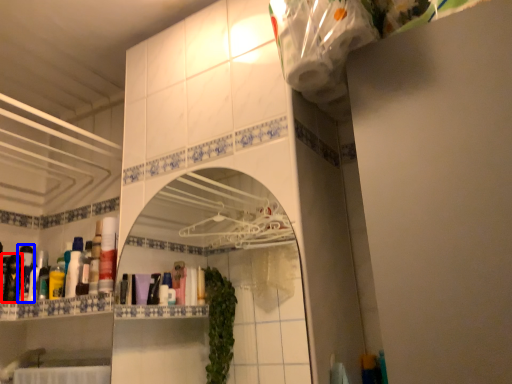
Question: Which object appears closest to the camera in this image, toiletry (highlighted by a red box) or toiletry (highlighted by a blue box)?

Choices:
 (A) toiletry
 (B) toiletry

Answer: (A)